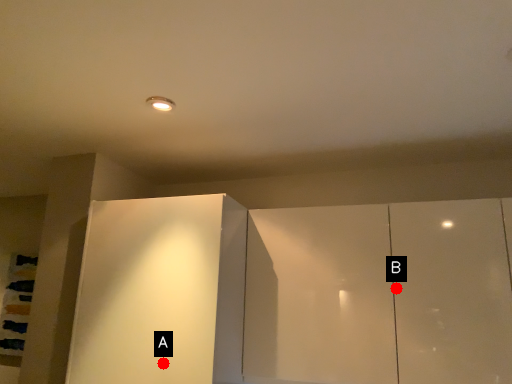
Question: Two points are circled on the image, labeled by A and B beside each circle. Which point appears farthest from the camera in this image?

Choices:
 (A) A is further
 (B) B is further

Answer: (B)